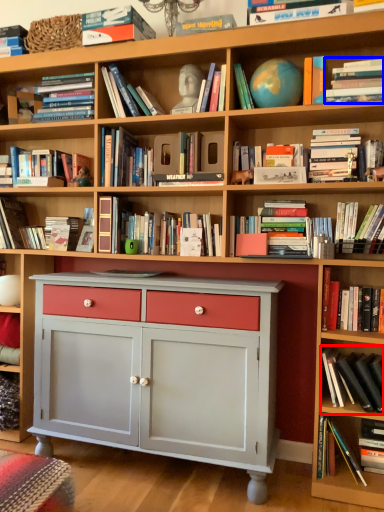
Question: Which of the following is the closest to the observer, book (highlighted by a red box) or book (highlighted by a blue box)?

Choices:
 (A) book
 (B) book

Answer: (B)